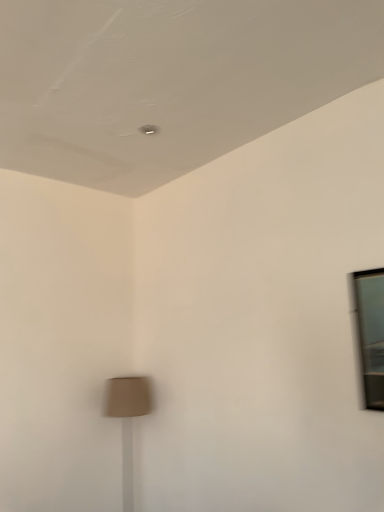
This screenshot has width=384, height=512. Describe the element at coordinates (128, 421) in the screenshot. I see `beige fabric lampshade at lower center` at that location.

In order to click on beige fabric lampshade at lower center in this screenshot , I will do `click(128, 421)`.

I want to click on beige fabric lampshade at lower center, so click(x=128, y=421).